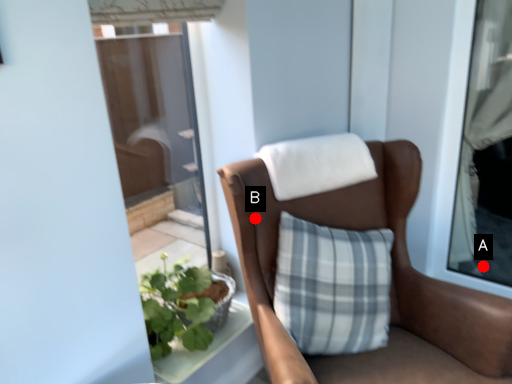
Question: Two points are circled on the image, labeled by A and B beside each circle. Which point appears closest to the camera in this image?

Choices:
 (A) A is closer
 (B) B is closer

Answer: (B)